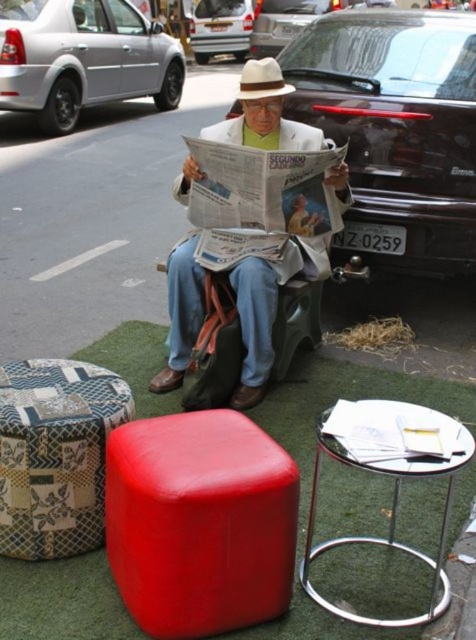
Question: Is silver metallic van at upper center above white felt cowboy hat at center?

Choices:
 (A) yes
 (B) no

Answer: (A)

Question: Which object appears closest to the camera in this image?

Choices:
 (A) patchwork fabric ottoman at lower left
 (B) silver metallic car at upper left
 (C) silver metallic van at upper center

Answer: (A)

Question: Is black leather car at upper center positioned at the back of metallic silver car at upper center?

Choices:
 (A) no
 (B) yes

Answer: (A)

Question: Is smooth leather stool at lower center to the right of white felt cowboy hat at center from the viewer's perspective?

Choices:
 (A) yes
 (B) no

Answer: (B)

Question: Which point appears closest to the camera in this image?

Choices:
 (A) (405, 241)
 (B) (42, 40)
 (C) (195, 13)
 (D) (271, 97)

Answer: (D)

Question: Which object appears closest to the camera in this image?

Choices:
 (A) silver metallic car at upper left
 (B) patchwork fabric ottoman at lower left

Answer: (B)